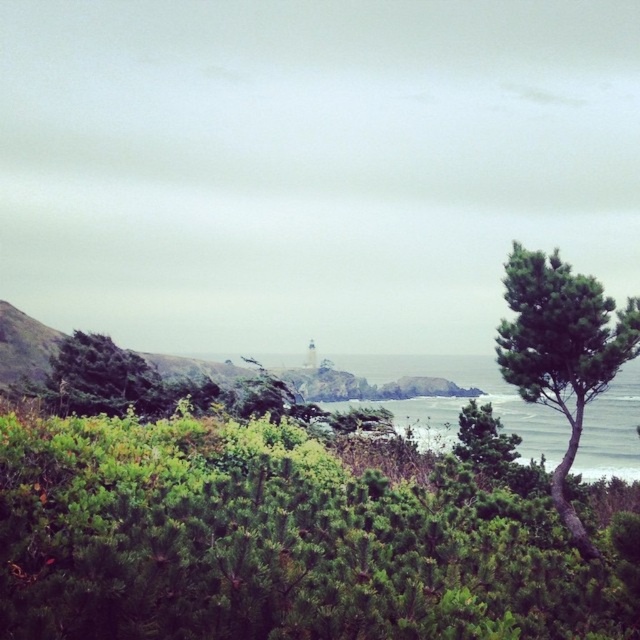
Question: Which point is farther to the camera?

Choices:
 (A) green textured tree at center-right
 (B) green leafy tree at left
 (C) green leafy tree at right

Answer: (A)

Question: Is green leafy tree at left positioned in front of green textured tree at center-right?

Choices:
 (A) yes
 (B) no

Answer: (A)

Question: Can you confirm if green leafy tree at left is positioned to the left of green textured tree at center-right?

Choices:
 (A) yes
 (B) no

Answer: (A)

Question: Does green leafy tree at right appear on the right side of green leafy tree at left?

Choices:
 (A) no
 (B) yes

Answer: (B)

Question: Among these objects, which one is nearest to the camera?

Choices:
 (A) green leafy tree at left
 (B) green leafy tree at right

Answer: (B)

Question: Which of these objects is positioned closest to the green leafy tree at left?

Choices:
 (A) green textured tree at center-right
 (B) green leafy tree at right

Answer: (A)